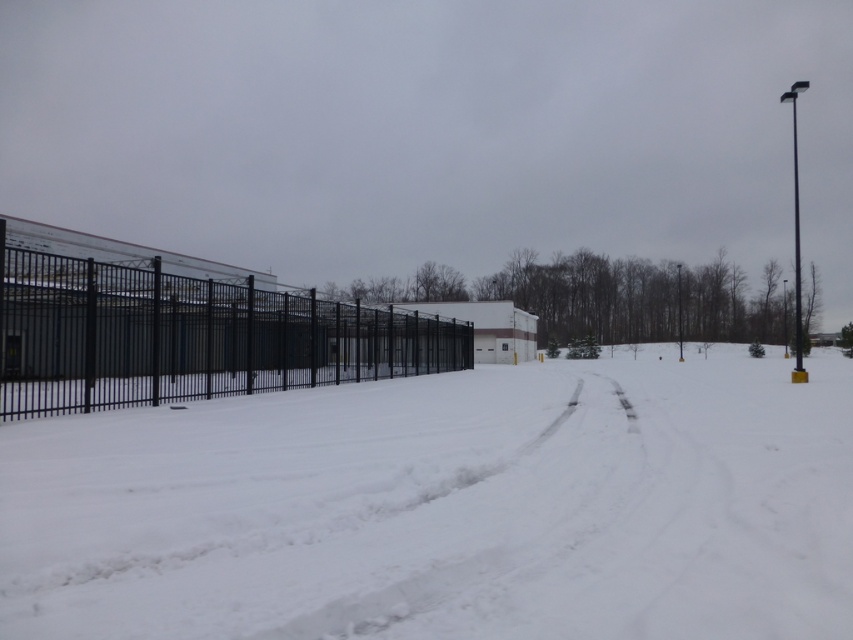
Which is behind, point (537, 552) or point (88, 324)?

The point (88, 324) is behind.

The image size is (853, 640). What do you see at coordinates (445, 508) in the screenshot?
I see `white powdery snow at center` at bounding box center [445, 508].

Find the location of a particular element. The image size is (853, 640). white powdery snow at center is located at coordinates (445, 508).